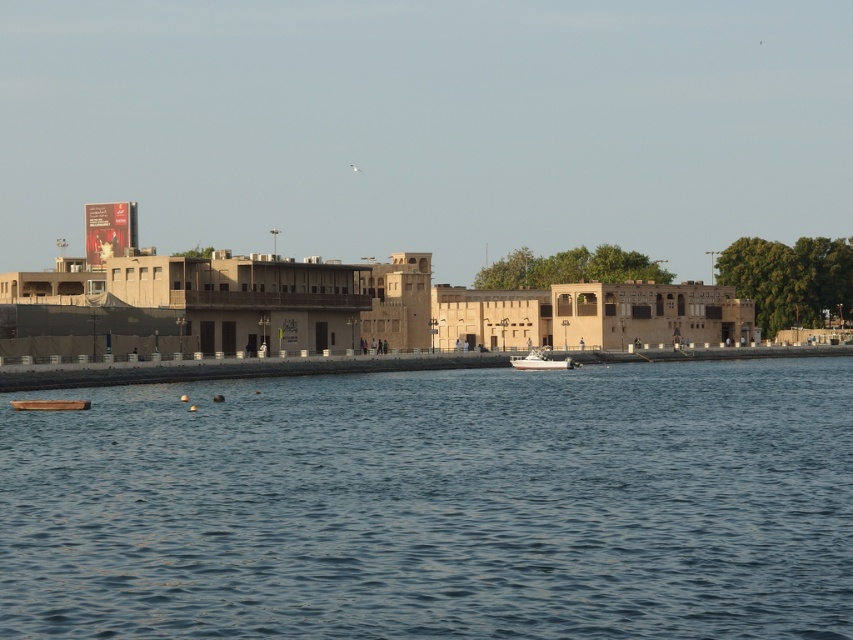
You are planning to dock a new boat that is the same size as the white glossy boat at center. If you want to place it near the blue water at lower center, will there be enough space?

The blue water at lower center is larger in size than the white glossy boat at center, so there will be enough space to dock the new boat of the same size near the blue water at lower center.

You are a tourist standing on the dock and want to take a photo of the white glossy boat at center and the blue water at lower center. Which object appears taller in the photo?

The white glossy boat at center appears taller than the blue water at lower center because the blue water at lower center is shorter than the white glossy boat at center.